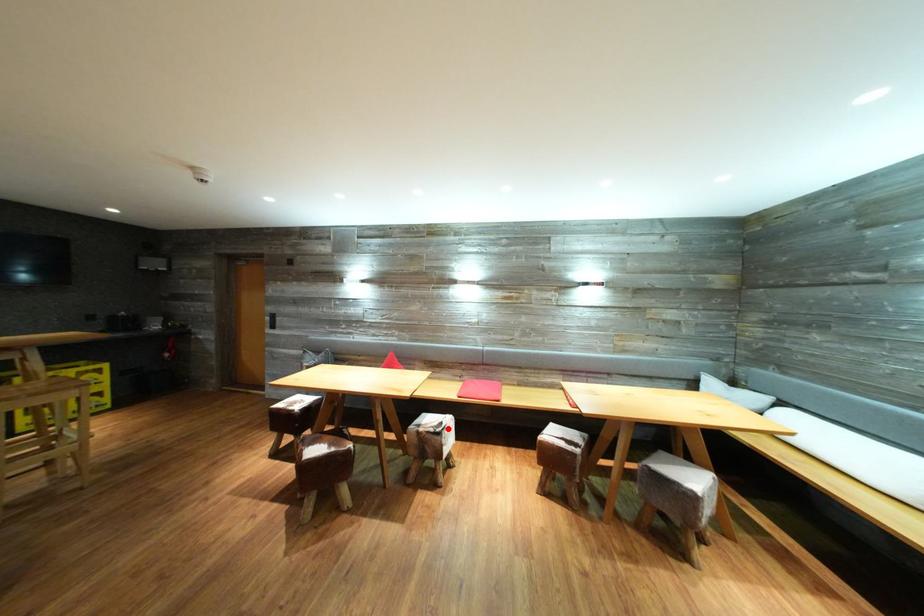
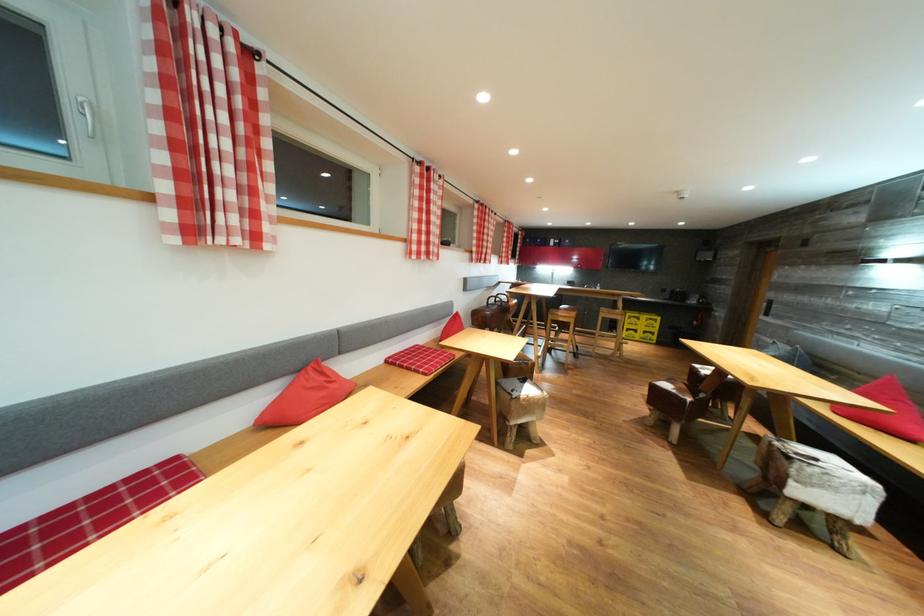
Question: I am providing you with two images of the same scene from different viewpoints. In image1, a red point is highlighted. Considering the same 3D point in image2, which of the following is correct?

Choices:
 (A) It is closer
 (B) It is farther

Answer: (A)